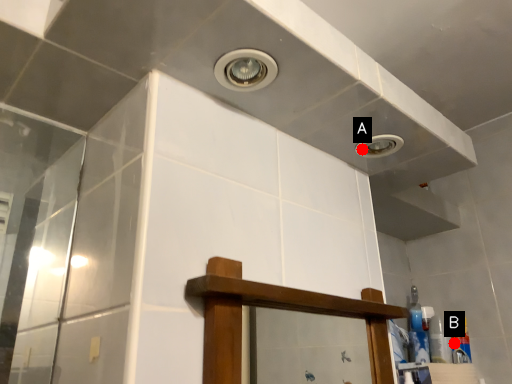
Question: Two points are circled on the image, labeled by A and B beside each circle. Which point appears farthest from the camera in this image?

Choices:
 (A) A is further
 (B) B is further

Answer: (B)